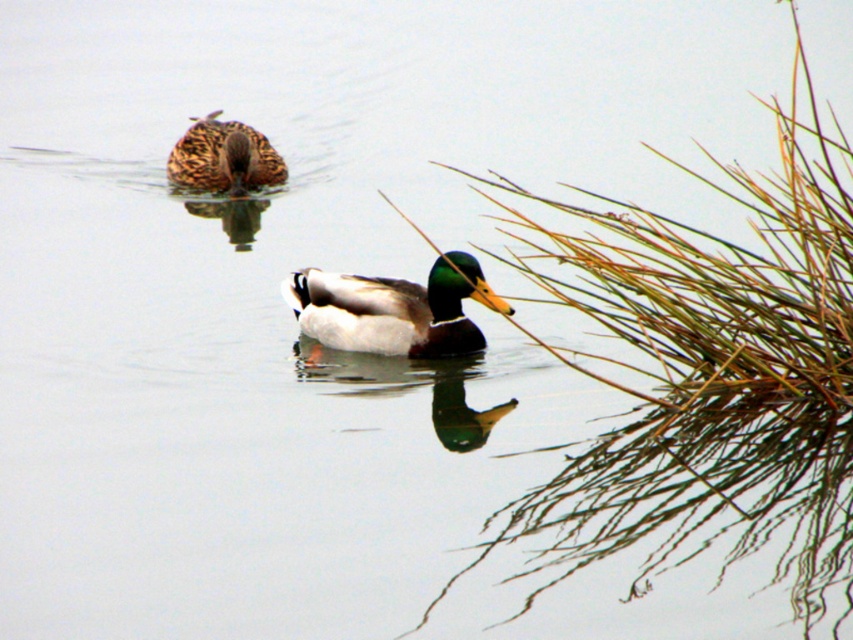
Is brown grass at right to the left of brown matte duck at upper left from the viewer's perspective?

No, brown grass at right is not to the left of brown matte duck at upper left.

Does brown grass at right have a smaller size compared to brown matte duck at upper left?

Actually, brown grass at right might be larger than brown matte duck at upper left.

This screenshot has width=853, height=640. I want to click on brown grass at right, so click(x=711, y=376).

Where is `brown grass at right`? The width and height of the screenshot is (853, 640). brown grass at right is located at coordinates (711, 376).

Who is taller, shiny green and white duck at center or brown matte duck at upper left?

brown matte duck at upper left

Can you confirm if shiny green and white duck at center is positioned to the right of brown matte duck at upper left?

Indeed, shiny green and white duck at center is positioned on the right side of brown matte duck at upper left.

Which is in front, point (445, 353) or point (241, 128)?

Point (445, 353) is in front.

Identify the location of shiny green and white duck at center. The image size is (853, 640). (393, 308).

Is brown grass at right bigger than shiny green and white duck at center?

Yes.

Between brown grass at right and shiny green and white duck at center, which one is positioned lower?

Positioned lower is brown grass at right.

Is point (712, 348) positioned behind point (316, 337)?

No, (712, 348) is closer to viewer.

Where is `brown grass at right`? The height and width of the screenshot is (640, 853). brown grass at right is located at coordinates (711, 376).